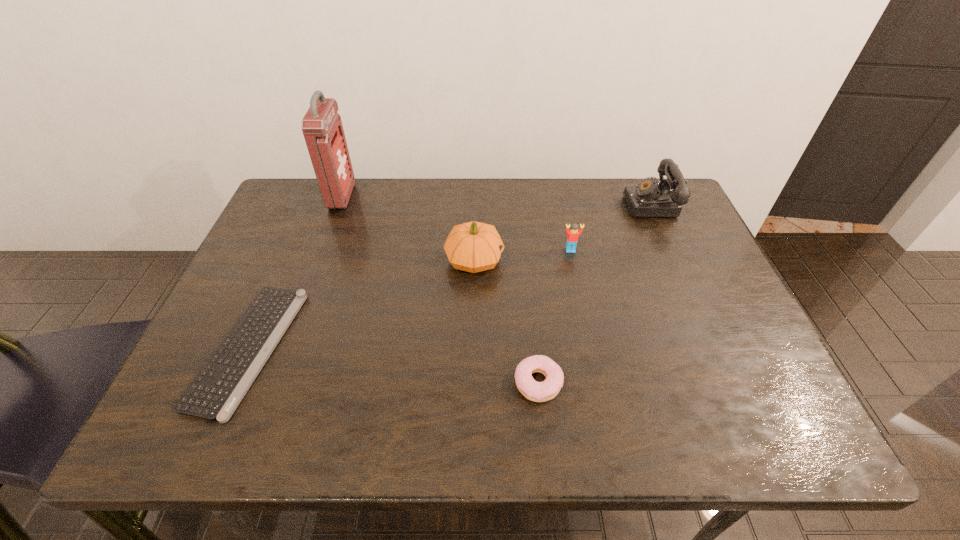
Where is `free space at the far left corner of the desktop`? The height and width of the screenshot is (540, 960). free space at the far left corner of the desktop is located at coordinates (285, 199).

Image resolution: width=960 pixels, height=540 pixels. In order to click on free location at the near right corner of the desktop in this screenshot , I will do `click(715, 418)`.

Find the location of a particular element. Image resolution: width=960 pixels, height=540 pixels. vacant region between the computer keyboard and the tallest object is located at coordinates (296, 273).

Locate an element on the screen. The height and width of the screenshot is (540, 960). free space between the fourth tallest object and the computer keyboard is located at coordinates (410, 299).

This screenshot has height=540, width=960. What are the coordinates of `vacant area that lies between the tallest object and the computer keyboard` in the screenshot? It's located at (296, 273).

Where is `vacant space that is in between the rightmost object and the shortest object`? Image resolution: width=960 pixels, height=540 pixels. vacant space that is in between the rightmost object and the shortest object is located at coordinates (450, 276).

This screenshot has height=540, width=960. Find the location of `vacant point located between the shortest object and the gourd`. vacant point located between the shortest object and the gourd is located at coordinates (361, 304).

Locate an element on the screen. free area in between the doughnut and the tallest object is located at coordinates (440, 290).

The height and width of the screenshot is (540, 960). In order to click on free area in between the fourth tallest object and the computer keyboard in this screenshot , I will do `click(410, 299)`.

In order to click on vacant area that lies between the Lego and the third object from right to left in this screenshot , I will do `click(554, 316)`.